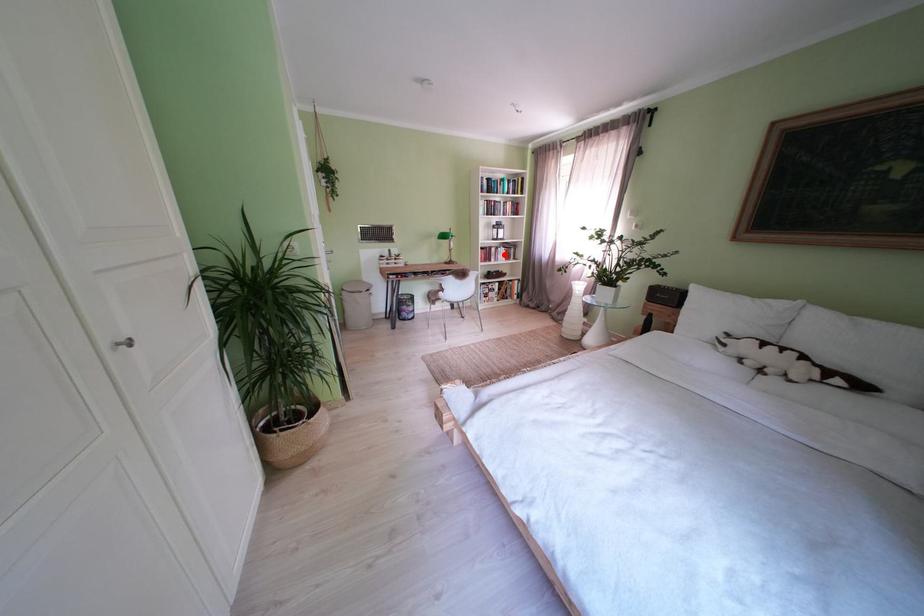
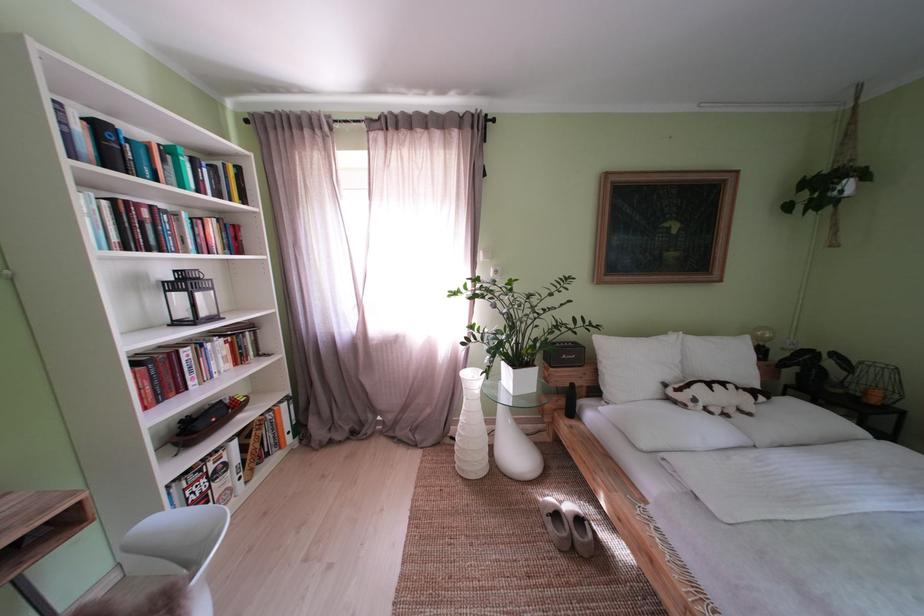
Question: I am providing you with two images of the same scene from different viewpoints. Image1 has a red point marked. In image2, the corresponding 3D location appears at what relative position? Reply with the corresponding letter.

Choices:
 (A) Closer
 (B) Farther

Answer: (B)